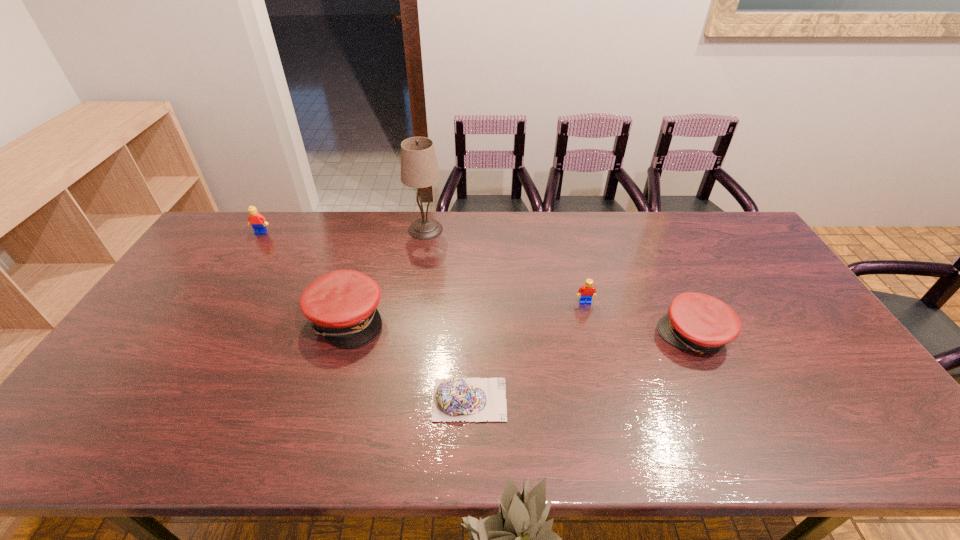
Image resolution: width=960 pixels, height=540 pixels. In order to click on lampshade at the far edge in this screenshot , I will do `click(419, 169)`.

This screenshot has width=960, height=540. Find the location of `Lego at the far edge`. Lego at the far edge is located at coordinates (258, 222).

This screenshot has width=960, height=540. Identify the location of object situated at the near edge. pyautogui.click(x=472, y=399).

In order to click on object that is at the left edge in this screenshot , I will do `click(258, 222)`.

Locate an element on the screen. This screenshot has height=540, width=960. object that is positioned at the far left corner is located at coordinates (258, 222).

Find the location of a particular element. The height and width of the screenshot is (540, 960). free spot at the far edge of the desktop is located at coordinates (365, 211).

Where is `free space at the near edge of the desktop`? Image resolution: width=960 pixels, height=540 pixels. free space at the near edge of the desktop is located at coordinates (599, 447).

I want to click on blank space at the left edge, so click(189, 265).

In order to click on vacant space in between the farther Lego and the lampshade in this screenshot , I will do `click(344, 231)`.

Locate an element on the screen. The width and height of the screenshot is (960, 540). free space between the second object from left to right and the tallest object is located at coordinates (386, 274).